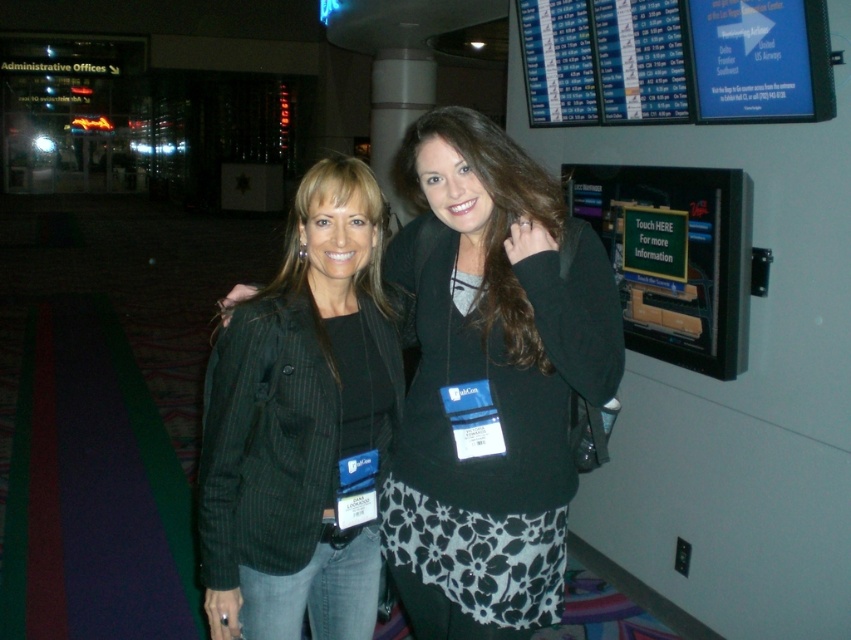
You are a photographer standing at the event and want to take a closeup shot of the black pinstripe blazer at center without including the flight information display board behind it. Can you do this?

The black pinstripe blazer at center is 5.05 feet from the viewer. Since the display board is in the background, adjusting the camera focus to the blazer while maintaining this distance should allow capturing the closeup without the board being in frame.

You are a photographer adjusting your camera settings to focus on the two blazers in the scene. Which blazer should you focus on first if you want to capture both the black pinstripe blazer at center and the green pinstripe blazer at center in sharp focus?

The black pinstripe blazer at center is located above the green pinstripe blazer at center, so focusing on the black pinstripe blazer at center first would ensure both are in sharp focus as they are vertically aligned.

You are at an event and want to find the black pinstripe blazer at center. The coordinates given are point (490, 381). If the coordinate system starts at the bottom left corner of the image, which direction should you look from the bottom left corner to find the black pinstripe blazer at center?

The point (490, 381) is located in the upper right quadrant of the image, so you should look towards the upper right direction from the bottom left corner to find the black pinstripe blazer at center.